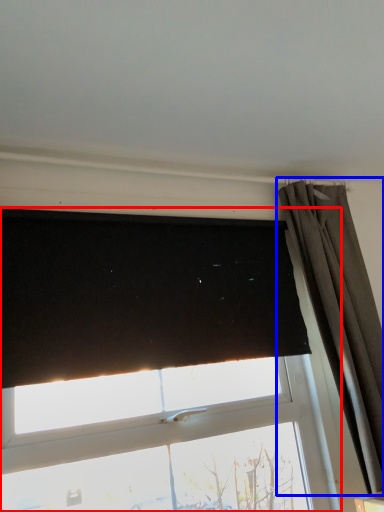
Question: Which of the following is the farthest to the observer, window (highlighted by a red box) or curtain (highlighted by a blue box)?

Choices:
 (A) window
 (B) curtain

Answer: (B)